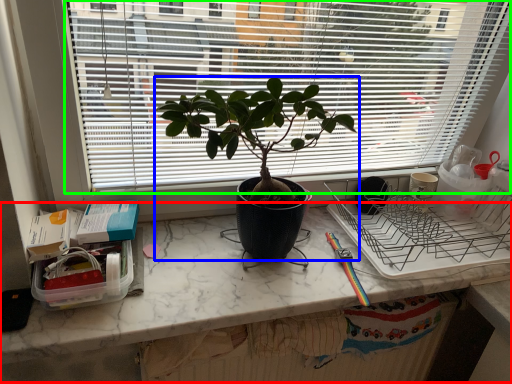
Question: Based on their relative distances, which object is farther from computer desk (highlighted by a red box)? Choose from houseplant (highlighted by a blue box) and window (highlighted by a green box).

Choices:
 (A) houseplant
 (B) window

Answer: (B)